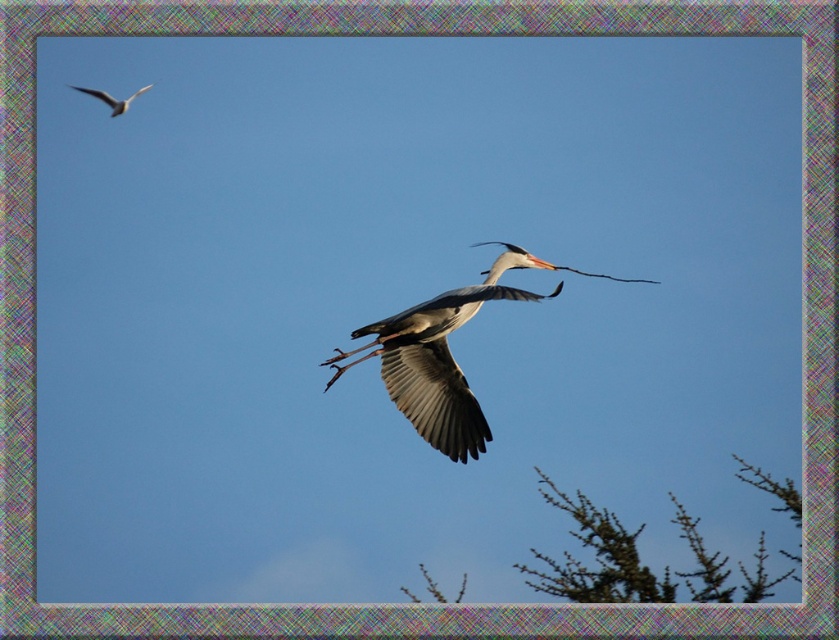
Question: Can you confirm if green textured branches at lower right is wider than gray matte bird at center?

Choices:
 (A) yes
 (B) no

Answer: (A)

Question: Which object is the farthest from the white glossy bird at upper left?

Choices:
 (A) green textured branches at lower right
 (B) gray matte bird at center

Answer: (A)

Question: Can you confirm if gray matte bird at center is positioned above white glossy bird at upper left?

Choices:
 (A) no
 (B) yes

Answer: (A)

Question: Among these points, which one is farthest from the camera?

Choices:
 (A) (504, 244)
 (B) (645, 582)
 (C) (124, 104)

Answer: (C)

Question: Does green textured branches at lower right come in front of gray matte bird at center?

Choices:
 (A) yes
 (B) no

Answer: (B)

Question: Which object is farther from the camera taking this photo?

Choices:
 (A) white glossy bird at upper left
 (B) green textured branches at lower right

Answer: (A)